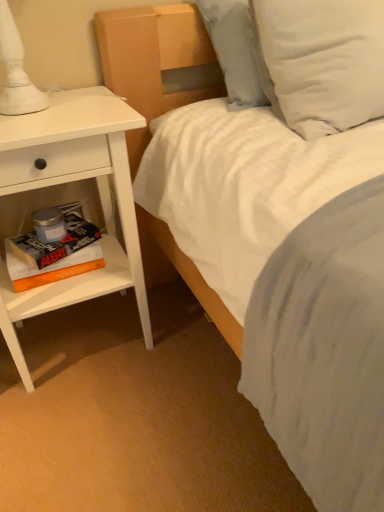
Question: Which is correct: orange matte book at lower left, which ranks as the 2th paperback book in top-to-bottom order, is inside white soft pillow at upper right, acting as the second pillow starting from the left, or outside of it?

Choices:
 (A) outside
 (B) inside

Answer: (A)

Question: Considering their positions, is orange matte book at lower left, which ranks as the 2th paperback book in top-to-bottom order, located in front of or behind white soft pillow at upper right, acting as the second pillow starting from the left?

Choices:
 (A) front
 (B) behind

Answer: (B)

Question: Which object is the farthest from the white textured pillow at upper right, which is the 2th pillow in right-to-left order?

Choices:
 (A) white soft pillow at upper right, acting as the second pillow starting from the left
 (B) orange matte book at lower left, which ranks as the 2th paperback book in top-to-bottom order
 (C) white matte nightstand at left
 (D) hardcover book at left, which is counted as the second paperback book, starting from the bottom

Answer: (B)

Question: Based on their relative distances, which object is nearer to the orange matte book at lower left, which ranks as the 2th paperback book in top-to-bottom order?

Choices:
 (A) white textured pillow at upper right, which is counted as the first pillow, starting from the left
 (B) white soft pillow at upper right, acting as the second pillow starting from the left
 (C) hardcover book at left, which is counted as the second paperback book, starting from the bottom
 (D) white matte nightstand at left

Answer: (C)